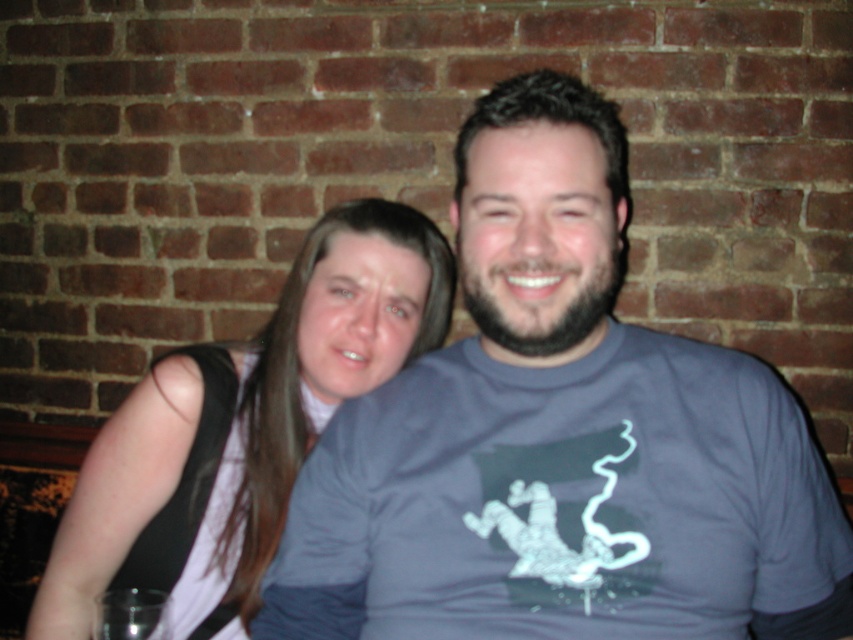
You are standing 6 feet away from the image. You want to touch the point at coordinates point (469, 564). Can you reach it without moving closer?

The point (469, 564) is 33.30 inches from the viewer. Since you are standing 6 feet away, which is 72 inches, you are farther away than the required distance. Therefore, you cannot reach it without moving closer.